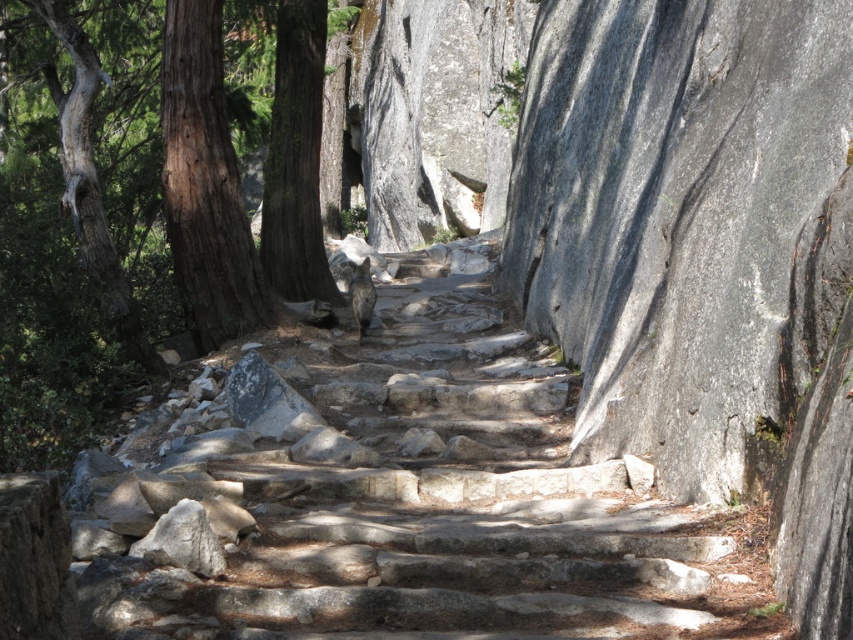
Is point (122, 496) farther from viewer compared to point (181, 52)?

No, it is not.

Is natural stone stairs at center shorter than brown rough bark tree at left?

Correct, natural stone stairs at center is not as tall as brown rough bark tree at left.

You are a GUI agent. You are given a task and a screenshot of the screen. Output one action in this format:
    pyautogui.click(x=<x>, y=<y>)
    Task: Click on the natural stone stairs at center
    This screenshot has height=640, width=853.
    Given the screenshot: What is the action you would take?
    pyautogui.click(x=393, y=497)

This screenshot has width=853, height=640. In order to click on natural stone stairs at center in this screenshot , I will do `click(393, 497)`.

Which is in front, point (194, 259) or point (283, 80)?

Point (194, 259)

Describe the element at coordinates (206, 184) in the screenshot. I see `brown rough bark tree at left` at that location.

Identify the location of brown rough bark tree at left. (206, 184).

Is natural stone stairs at center to the right of gray textured bark tree at left from the viewer's perspective?

Correct, you'll find natural stone stairs at center to the right of gray textured bark tree at left.

Which is in front, point (538, 598) or point (100, 291)?

Point (538, 598) is in front.

Which is in front, point (235, 360) or point (119, 298)?

Point (235, 360) is in front.

In order to click on natural stone stairs at center in this screenshot , I will do `click(393, 497)`.